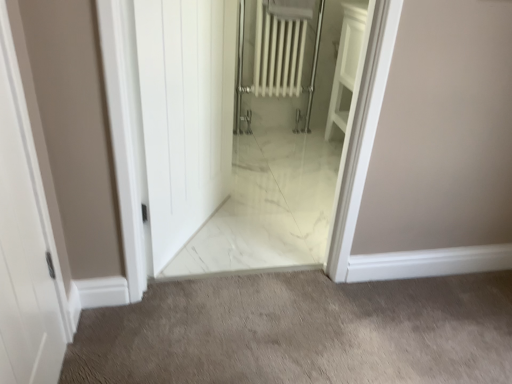
Question: Is white marble floor at center taller or shorter than white marble elevator at center?

Choices:
 (A) short
 (B) tall

Answer: (A)

Question: Is white marble floor at center wider or thinner than white marble elevator at center?

Choices:
 (A) thin
 (B) wide

Answer: (B)

Question: Estimate the real-world distances between objects in this image. Which object is farther from the white marble floor at center?

Choices:
 (A) white marble elevator at center
 (B) white glossy door at center, placed as the 2th door when sorted from front to back
 (C) white matte door at left, the 1th door from the left

Answer: (A)

Question: Considering the real-world distances, which object is farthest from the white matte door at left, which ranks as the 2th door in right-to-left order?

Choices:
 (A) white glossy door at center, placed as the 2th door when sorted from front to back
 (B) white marble floor at center
 (C) white marble elevator at center

Answer: (C)